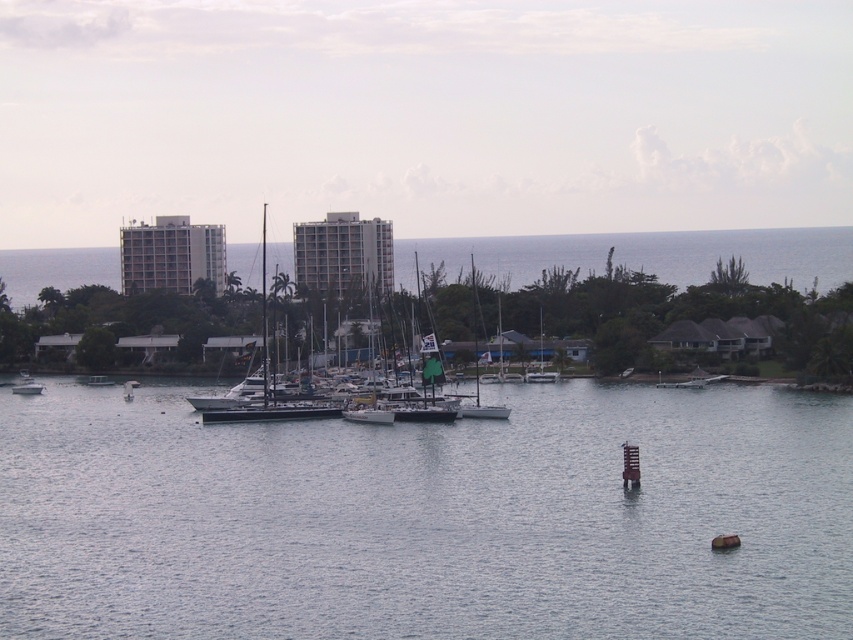
Is clear water at center below dark gray metallic sailboat at center?

Indeed, clear water at center is positioned under dark gray metallic sailboat at center.

Which is in front, point (20, 547) or point (263, 250)?

Point (20, 547) is more forward.

This screenshot has width=853, height=640. Describe the element at coordinates (427, 516) in the screenshot. I see `clear water at center` at that location.

Find the location of a particular element. clear water at center is located at coordinates [427, 516].

How far apart are clear water at center and brown wooden buoy at lower right?

44.40 meters

Which is more to the right, clear water at center or brown wooden buoy at lower right?

Positioned to the right is brown wooden buoy at lower right.

The height and width of the screenshot is (640, 853). Describe the element at coordinates (427, 516) in the screenshot. I see `clear water at center` at that location.

The width and height of the screenshot is (853, 640). I want to click on clear water at center, so click(427, 516).

Looking at this image, who is more forward, (312, 406) or (712, 548)?

Point (712, 548)

Does point (289, 412) come in front of point (720, 540)?

No, it is not.

The width and height of the screenshot is (853, 640). I want to click on dark gray metallic sailboat at center, so click(x=265, y=376).